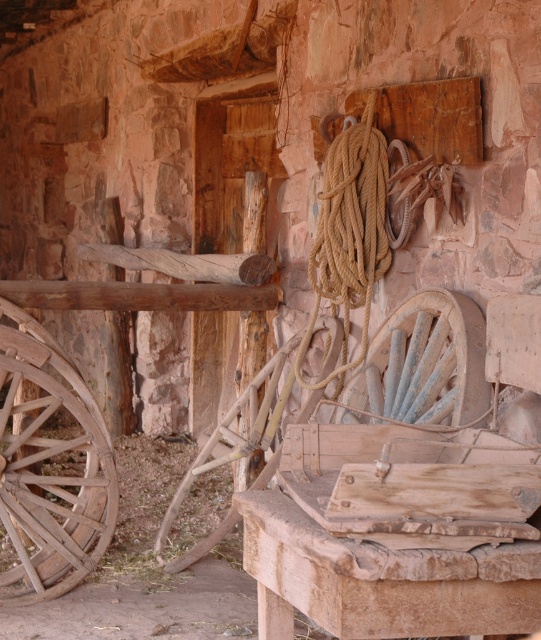
You are standing in front of the stone wall and want to place a small potted plant between the weathered wood wagon wheel at left and the rusty metal wagon wheel at center. Based on their positions, where should you place the plant to ensure it is between them?

The weathered wood wagon wheel at left is located below the rusty metal wagon wheel at center, so placing the plant between them would require positioning it above the weathered wood wagon wheel at left and below the rusty metal wagon wheel at center.

You are a museum curator planning to display both the weathered wood wagon wheel at left and the rusty metal wagon wheel at center. Based on their sizes, which one should be placed on the taller stand to ensure proper visibility?

The weathered wood wagon wheel at left should be placed on the taller stand since it has a greater height than the rusty metal wagon wheel at center.

You are a maintenance worker tasked with moving both the weathered wood wagon wheel at left and the rusty metal wagon wheel at center to a storage shed located 2 meters away from the current position. The path between them is narrow. Can you move them side by side without overlapping?

The distance between the weathered wood wagon wheel at left and the rusty metal wagon wheel at center is 1.42 meters. Since the path to the shed is 2 meters wide, you can move them side by side as the combined width of the wheels would need to be less than 1.42 meters to fit within the available space. However, without knowing the individual widths of each wheel, it is impossible to confirm if they can fit side by side without overlapping.